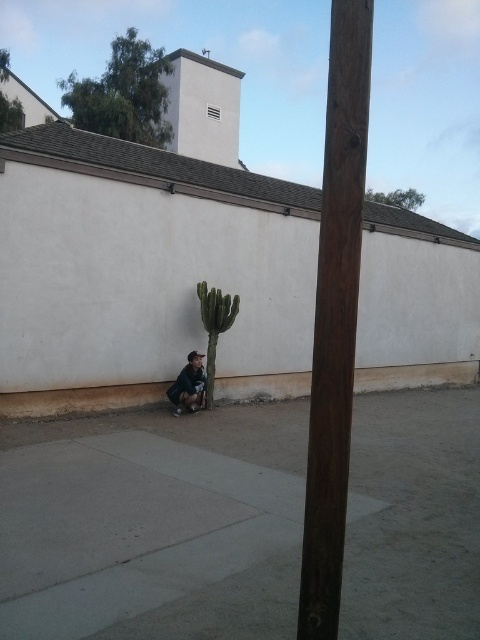
Question: Which of the following is the closest to the observer?

Choices:
 (A) gray concrete pavement at lower center
 (B) dark blue jeans at lower center
 (C) brown wooden pole at center

Answer: (C)

Question: Considering the relative positions of gray concrete pavement at lower center and dark blue jeans at lower center in the image provided, where is gray concrete pavement at lower center located with respect to dark blue jeans at lower center?

Choices:
 (A) left
 (B) right

Answer: (B)

Question: Which object is positioned closest to the brown wooden pole at center?

Choices:
 (A) green spiky cactus at lower center
 (B) gray concrete pavement at lower center

Answer: (A)

Question: Does green spiky cactus at lower center appear on the left side of dark blue jeans at lower center?

Choices:
 (A) yes
 (B) no

Answer: (B)

Question: Which of the following is the closest to the observer?

Choices:
 (A) dark blue jeans at lower center
 (B) brown concrete curb at lower left
 (C) gray concrete pavement at lower center
 (D) brown wooden pole at center

Answer: (D)

Question: Is gray concrete pavement at lower center smaller than brown wooden pole at center?

Choices:
 (A) yes
 (B) no

Answer: (A)